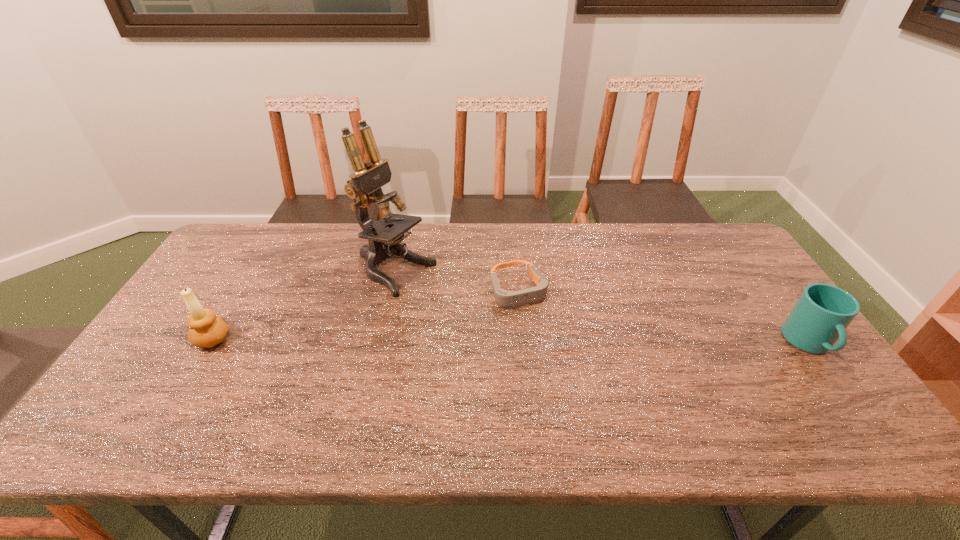
Identify the location of vacant area at the near edge of the desktop. (620, 388).

Where is `vacant region at the right edge of the desktop`? This screenshot has height=540, width=960. vacant region at the right edge of the desktop is located at coordinates (720, 277).

Where is `blank space at the far left corner of the desktop`? The width and height of the screenshot is (960, 540). blank space at the far left corner of the desktop is located at coordinates click(249, 264).

The width and height of the screenshot is (960, 540). What are the coordinates of `vacant area between the second object from right to left and the second shortest object` in the screenshot? It's located at (663, 316).

Where is `vacant space that is in between the cup and the shortest object`? vacant space that is in between the cup and the shortest object is located at coordinates (663, 316).

This screenshot has height=540, width=960. I want to click on free point between the second object from right to left and the second shortest object, so click(663, 316).

The width and height of the screenshot is (960, 540). I want to click on free point between the rightmost object and the microscope, so click(x=602, y=308).

The width and height of the screenshot is (960, 540). I want to click on free point between the leftmost object and the shortest object, so click(366, 314).

Where is `empty space between the third shortest object and the third object from left to right`? empty space between the third shortest object and the third object from left to right is located at coordinates (366, 314).

The image size is (960, 540). What are the coordinates of `empty location between the third object from right to left and the shortest object` in the screenshot? It's located at (457, 281).